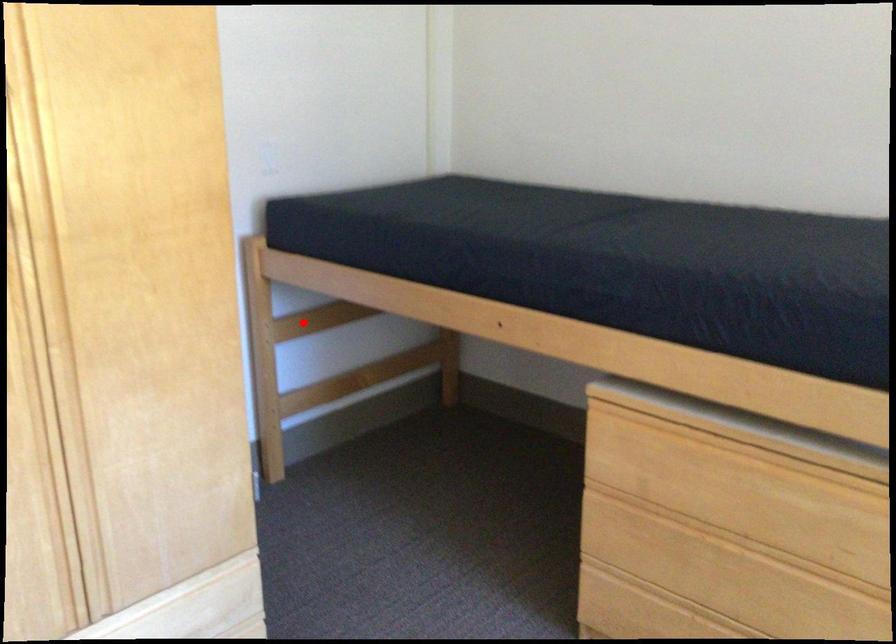
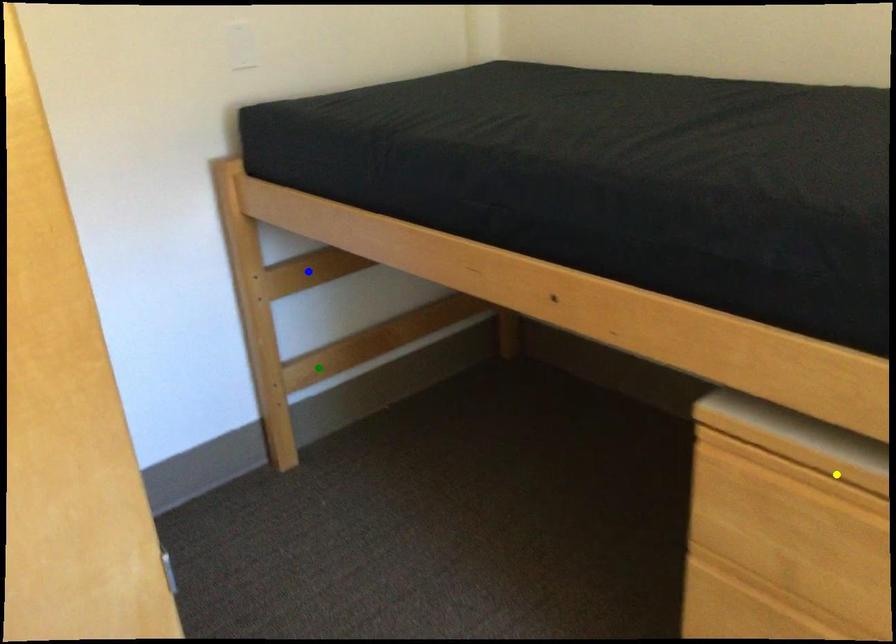
Question: I am providing you with two images of the same scene from different viewpoints. A red point is marked on the first image. You are given multiple points on the second image. Which mark in image 2 goes with the point in image 1?

Choices:
 (A) yellow point
 (B) blue point
 (C) green point

Answer: (B)